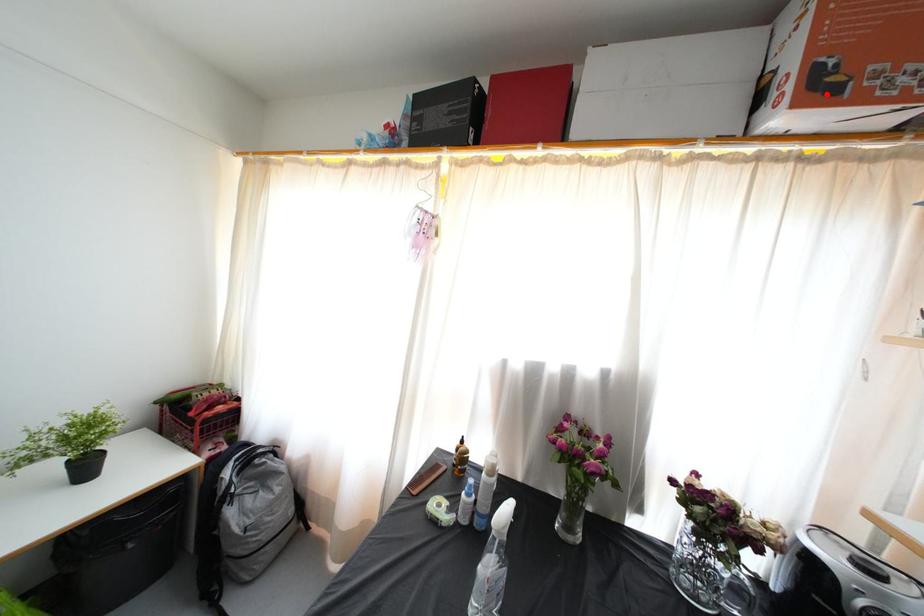
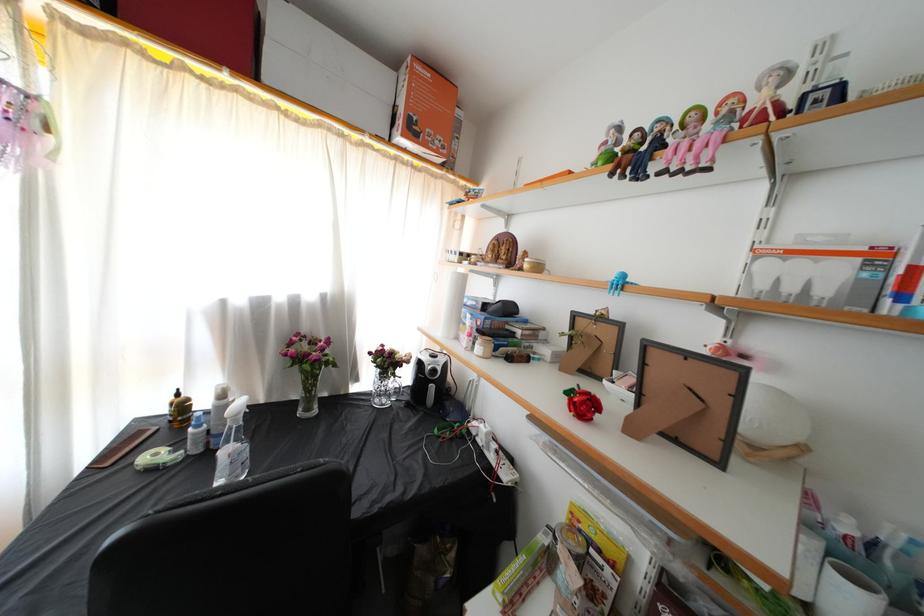
The point at the highlighted location is marked in the first image. Where is the corresponding point in the second image?

(418, 137)